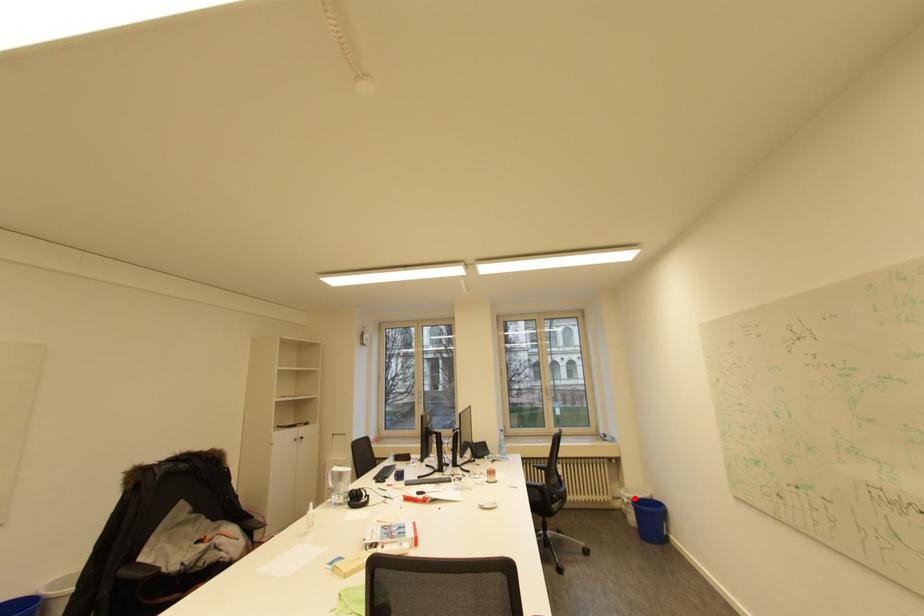
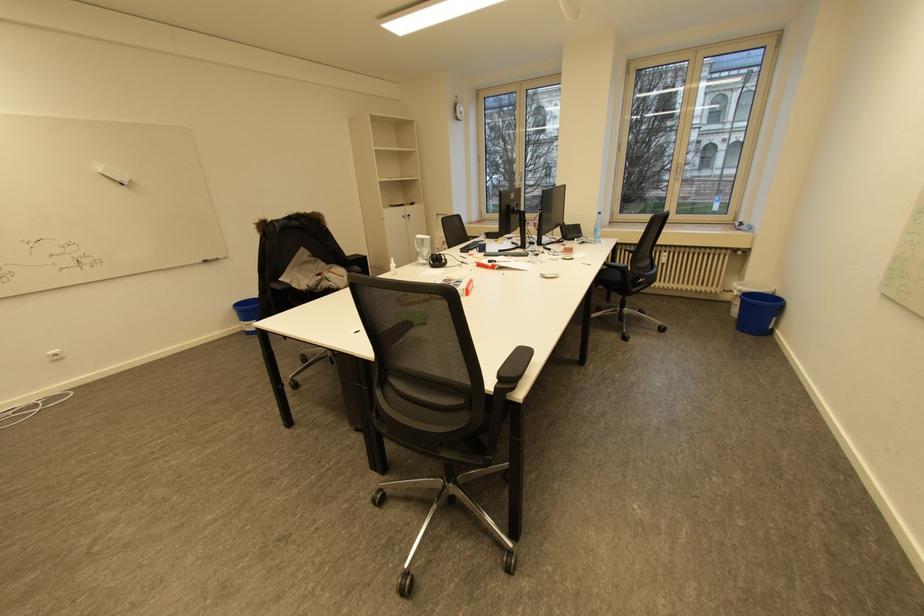
Question: I am providing you with two images of the same scene from different viewpoints. A red point is shown in image1. For the corresponding object point in image2, is it positioned nearer or farther from the camera?

Choices:
 (A) Nearer
 (B) Farther

Answer: (A)